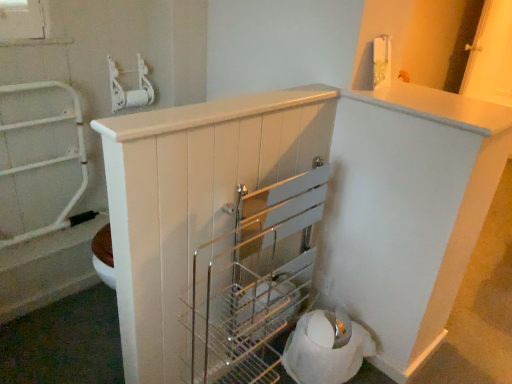
Measure the distance between point (x=506, y=120) and camera.

A distance of 4.13 feet exists between point (x=506, y=120) and camera.

Image resolution: width=512 pixels, height=384 pixels. What are the coordinates of `white matte counter top at upper right` in the screenshot? It's located at (439, 107).

The width and height of the screenshot is (512, 384). What do you see at coordinates (439, 107) in the screenshot? I see `white matte counter top at upper right` at bounding box center [439, 107].

I want to click on white matte counter top at upper right, so click(439, 107).